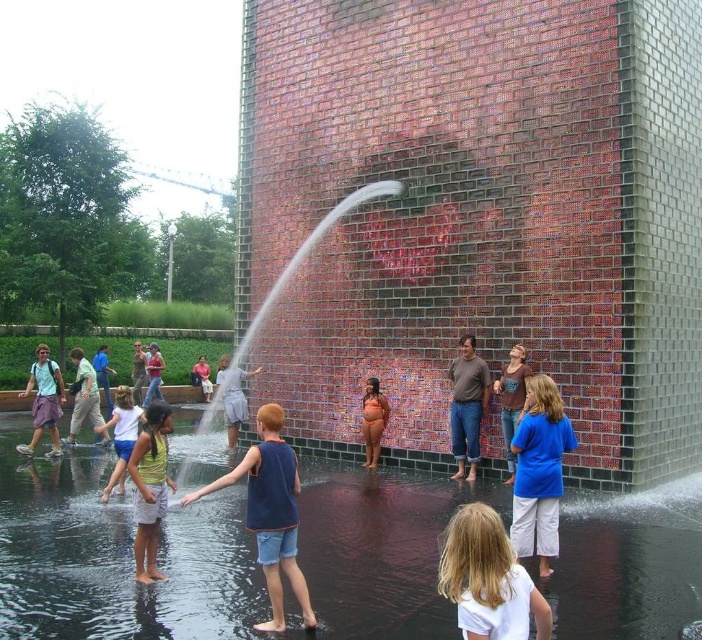
You are a photographer trying to capture a group photo of two people wearing the matte white shirt at center and the matte gray tank top at center. If you want to ensure both subjects are fully visible in the frame, which subject should you position closer to the camera to avoid being cut off?

You should position the matte gray tank top at center closer to the camera because the matte white shirt at center might be wider and could potentially block part of the matte gray tank top at center if both are at the same distance.

You are standing at the water feature and want to take a photo of both the point at coordinates (456, 561) and the point at coordinates (138, 378). Which point should you focus on first to ensure both are in focus?

You should focus on the point at coordinates (456, 561) first because it is closer to the camera than the point at coordinates (138, 378). This ensures the closer point is in focus, and the farther point will also be in focus due to depth of field.